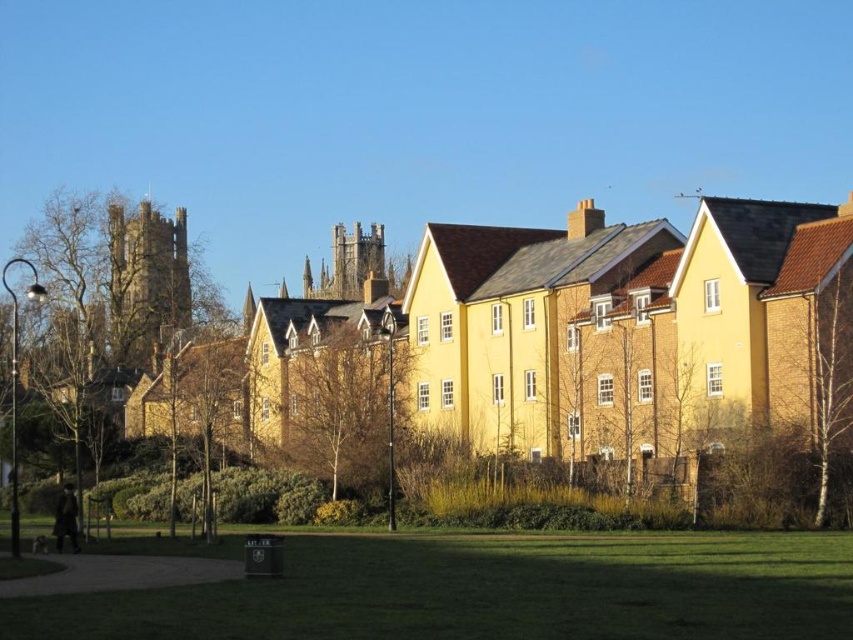
Can you confirm if brown textured tree at center is positioned below white textured tree at right?

Correct, brown textured tree at center is located below white textured tree at right.

Which is more to the right, brown textured tree at center or white textured tree at right?

From the viewer's perspective, white textured tree at right appears more on the right side.

This screenshot has width=853, height=640. Describe the element at coordinates (346, 400) in the screenshot. I see `brown textured tree at center` at that location.

Where is `brown textured tree at center`? brown textured tree at center is located at coordinates (346, 400).

Which of these two, white textured tree at right or smooth brown tree at lower left, stands taller?

Standing taller between the two is white textured tree at right.

Is white textured tree at right positioned before smooth brown tree at lower left?

No.

Is point (817, 307) behind point (233, 365)?

That is False.

Identify the location of white textured tree at right. The image size is (853, 640). (815, 369).

Can you confirm if brown textured tree at center is wider than smooth brown tree at lower left?

In fact, brown textured tree at center might be narrower than smooth brown tree at lower left.

Is brown textured tree at center to the right of smooth brown tree at lower left from the viewer's perspective?

Yes, brown textured tree at center is to the right of smooth brown tree at lower left.

Who is more forward, (318,394) or (189,368)?

Point (318,394) is in front.

Find the location of a particular element. The height and width of the screenshot is (640, 853). brown textured tree at center is located at coordinates (346, 400).